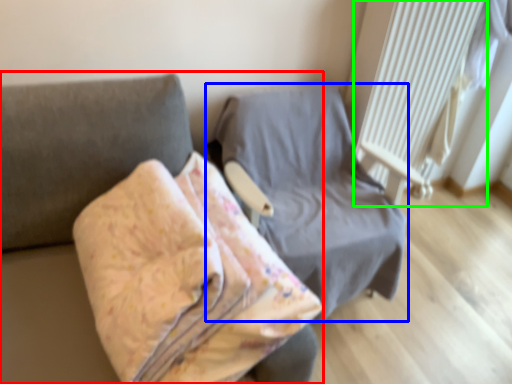
Question: Based on their relative distances, which object is nearer to furniture (highlighted by a red box)? Choose from furniture (highlighted by a blue box) and radiator (highlighted by a green box).

Choices:
 (A) furniture
 (B) radiator

Answer: (A)